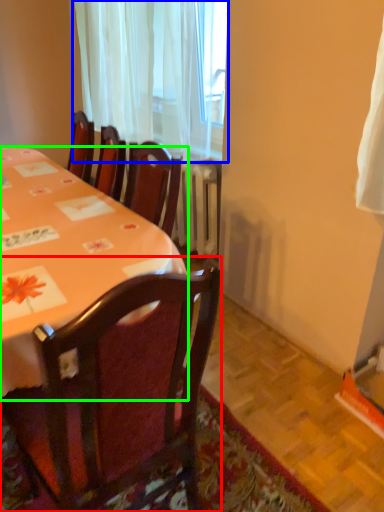
Question: Considering the real-world distances, which object is closest to chair (highlighted by a red box)? curtain (highlighted by a blue box) or desk (highlighted by a green box).

Choices:
 (A) curtain
 (B) desk

Answer: (B)